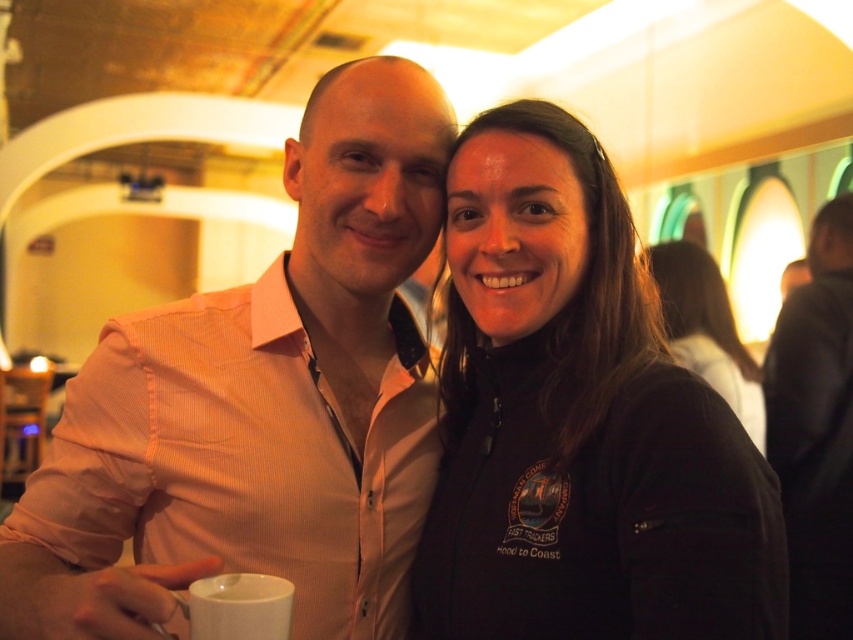
Based on the photo, you are trying to decide which item to grab first from the center of the image. The pink shirt at center and the black fleece jacket at center are both in your reach. Which one is taller?

The pink shirt at center has a greater height compared to the black fleece jacket at center, so the pink shirt at center is taller.

What is located at the coordinates point [260,404] in the image?

The pink shirt at center is located at point [260,404].